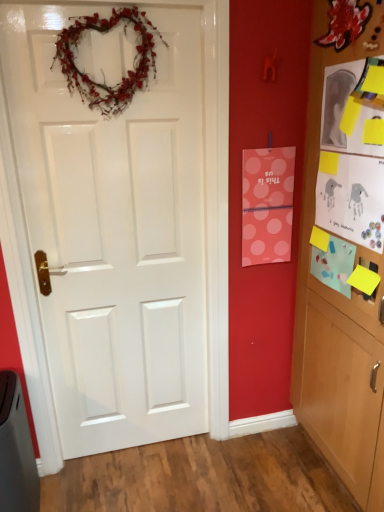
Identify the location of vacant area located to the right-hand side of white glossy door at center. The width and height of the screenshot is (384, 512). (229, 465).